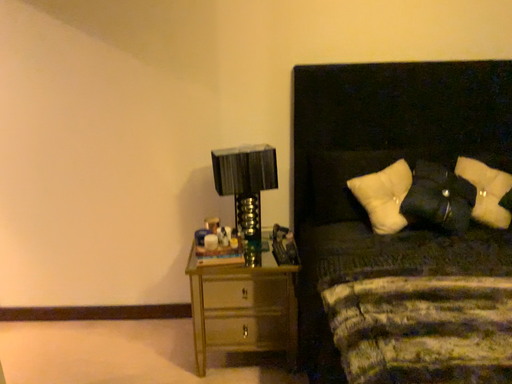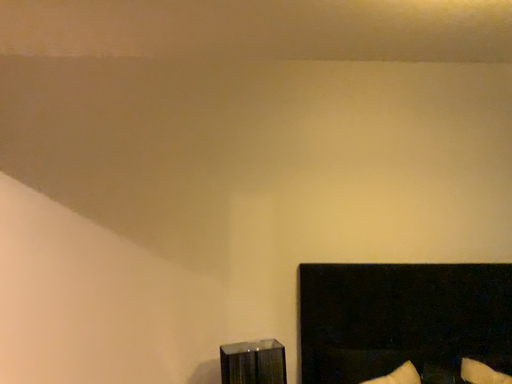
Question: Which way did the camera rotate in the video?

Choices:
 (A) rotated downward
 (B) rotated upward

Answer: (B)